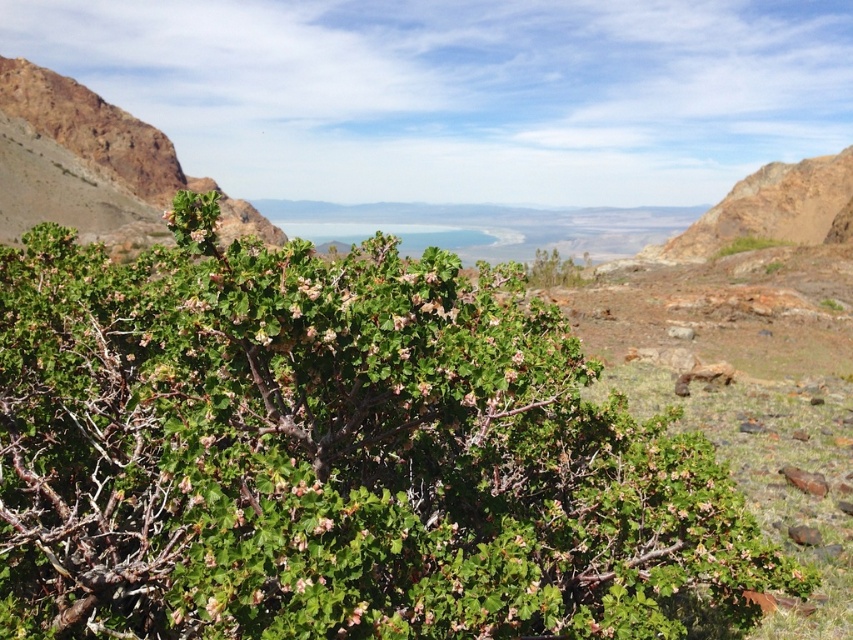
Between point (395, 563) and point (177, 163), which one is positioned in front?

Point (395, 563)

Who is higher up, green leafy bush at center or green leafy bush at upper left?

green leafy bush at upper left is higher up.

Locate an element on the screen. green leafy bush at center is located at coordinates (334, 454).